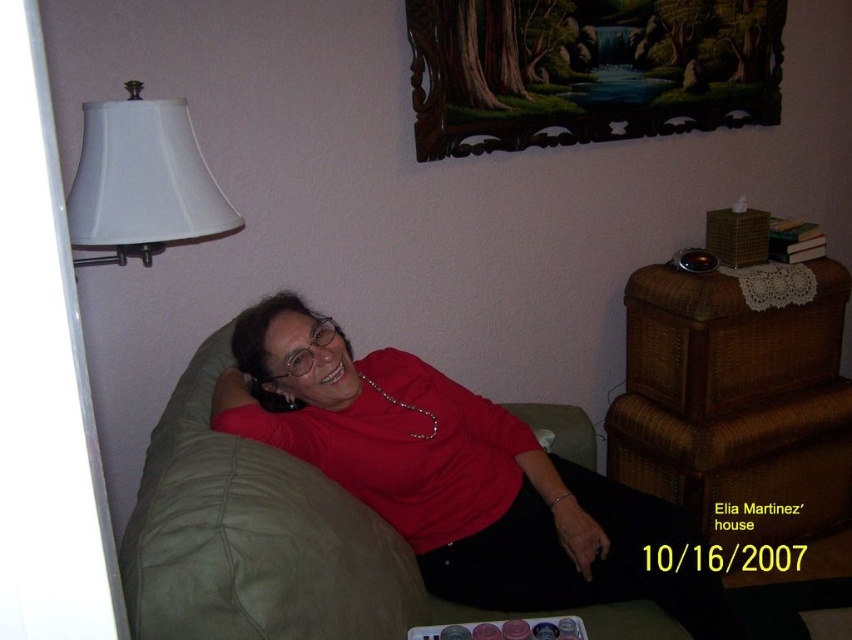
You are taking a photo of the scene and want to focus on both point [79,214] and point [418,435]. Since the camera can only focus on one point at a time, which point should you choose to ensure the closer one is in focus?

You should focus on point [79,214] because it is closer to the camera than point [418,435].

Consider the image. You are a fashion designer observing the image. You need to determine which item is larger between the matte red blouse at center and the silver metallic necklace at center. Which one is bigger?

The matte red blouse at center is bigger than the silver metallic necklace at center.

You are a photographer standing in the room and want to take a photo of the dark wood picture frame at upper center. The camera you are holding has a minimum focusing distance of 2 meters. Can you take the photo without moving closer?

The dark wood picture frame at upper center and camera are 1.95 meters apart from each other. Since the minimum focusing distance is 2 meters, the photographer needs to move back 0.05 meters to take the photo.